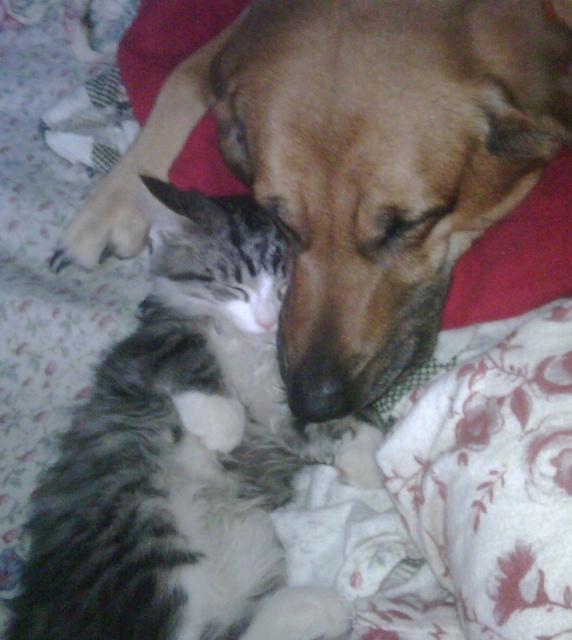
Who is more distant from viewer, (412, 296) or (53, 493)?

The point (412, 296) is behind.

Is the position of brown matte dog at center more distant than that of tabby fur cat at center?

Yes, it is behind tabby fur cat at center.

Who is more distant from viewer, (x=331, y=108) or (x=170, y=436)?

The point (x=170, y=436) is more distant.

Locate an element on the screen. brown matte dog at center is located at coordinates (359, 163).